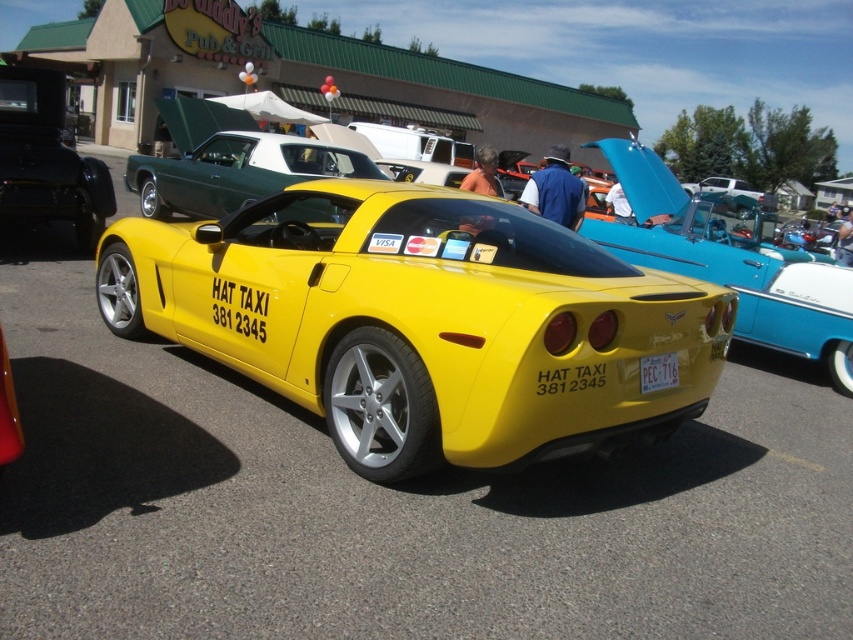
Question: Which point is farther to the camera?

Choices:
 (A) (293, 180)
 (B) (660, 384)

Answer: (A)

Question: Considering the relative positions of yellow matte sports car at center and green metallic car at upper left in the image provided, where is yellow matte sports car at center located with respect to green metallic car at upper left?

Choices:
 (A) right
 (B) left

Answer: (A)

Question: Among these points, which one is farthest from the camera?

Choices:
 (A) (216, 205)
 (B) (616, 426)
 (C) (656, 365)

Answer: (A)

Question: Estimate the real-world distances between objects in this image. Which object is farther from the green metallic car at upper left?

Choices:
 (A) white plastic license plate at rear
 (B) yellow matte sports car at center

Answer: (A)

Question: Is yellow matte sports car at center smaller than white plastic license plate at rear?

Choices:
 (A) yes
 (B) no

Answer: (B)

Question: Can you confirm if yellow matte sports car at center is bigger than white plastic license plate at rear?

Choices:
 (A) no
 (B) yes

Answer: (B)